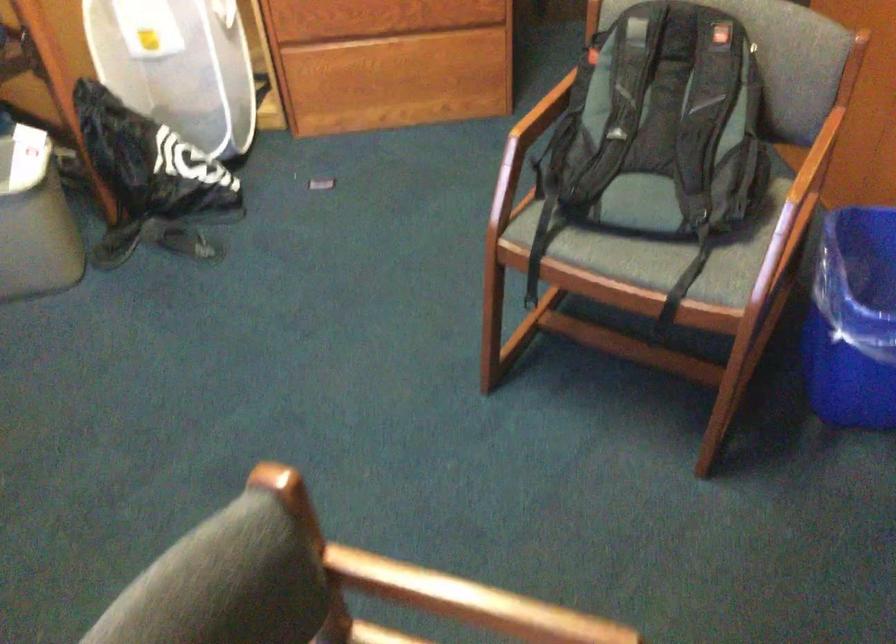
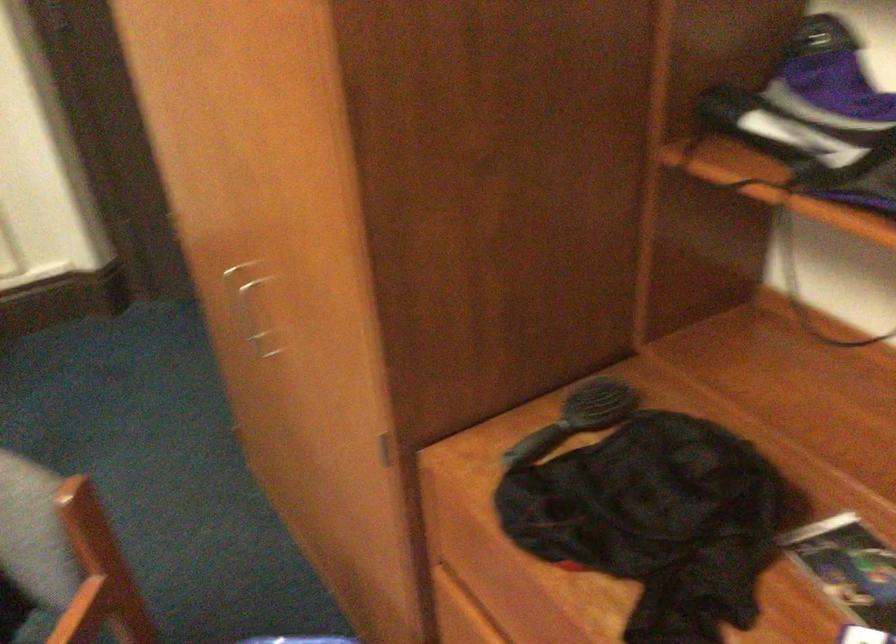
Which direction would the cameraman need to move to produce the second image?

The cameraman walked toward right, forward.